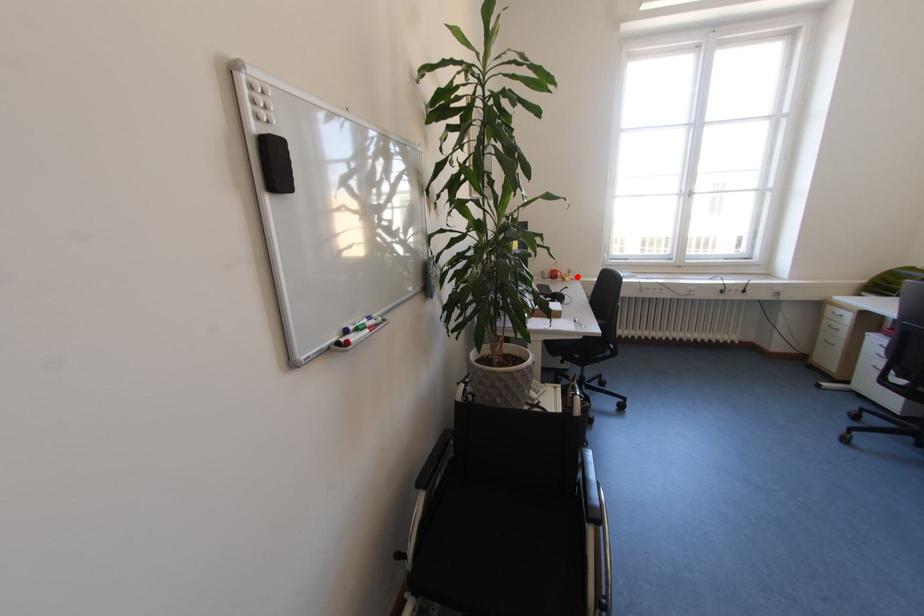
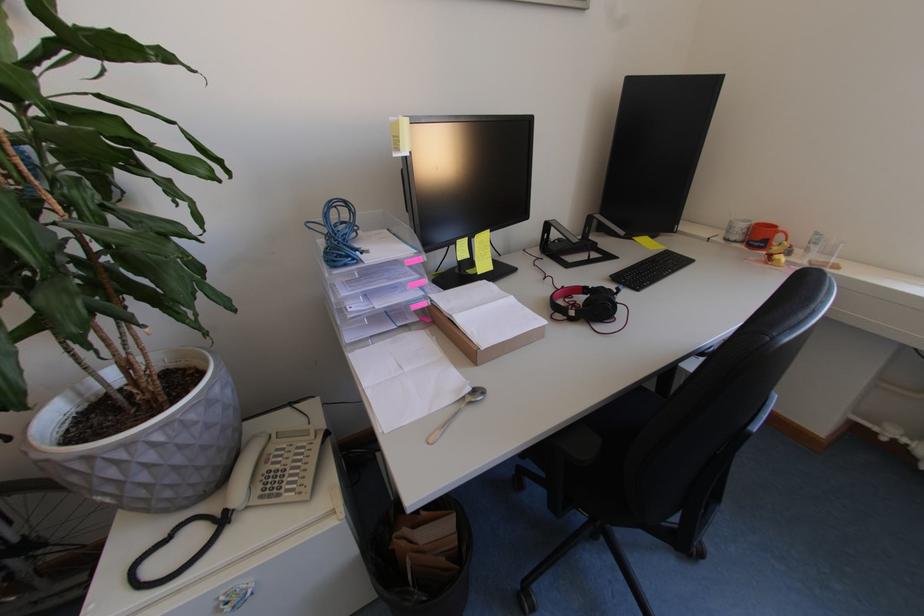
Locate, in the second image, the point that corresponds to the highlighted location in the first image.

(816, 253)